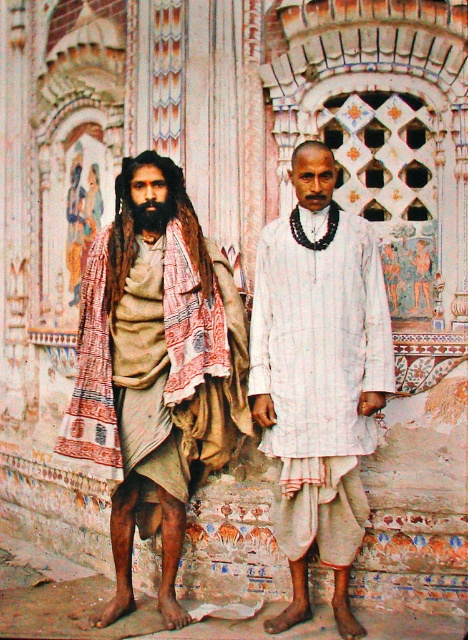
You are a photographer trying to capture both the white striped shirt at center and the black fuzzy beard at left in a single frame. Based on their widths, which object should you position closer to the camera to ensure both fit within the frame?

The white striped shirt at center is wider than the black fuzzy beard at left. To ensure both fit in the frame, position the white striped shirt at center closer to the camera since its greater width requires more space in the frame.

You are observing two people in front of a temple. You see a white striped shirt at center and a black fuzzy beard at left. Which one is more to the right?

The white striped shirt at center is more to the right than the black fuzzy beard at left.